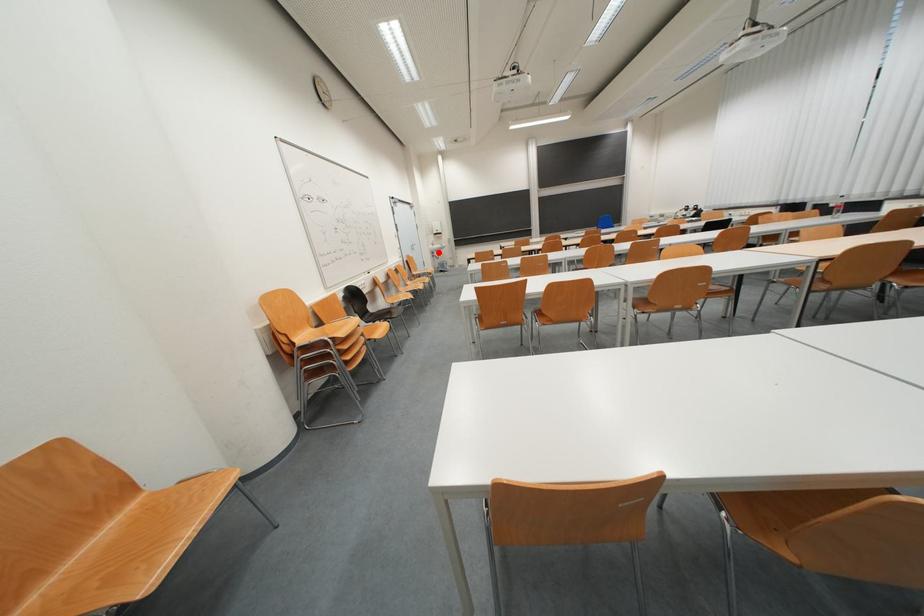
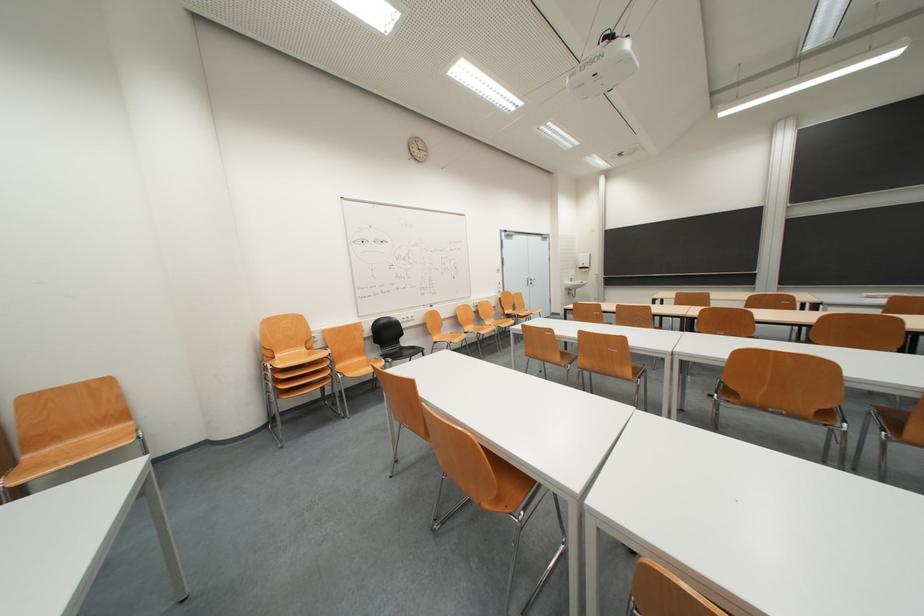
Question: I am providing you with two images of the same scene from different viewpoints. In image1, a red point is highlighted. Considering the same 3D point in image2, which of the following is correct?

Choices:
 (A) It is closer
 (B) It is farther

Answer: (B)